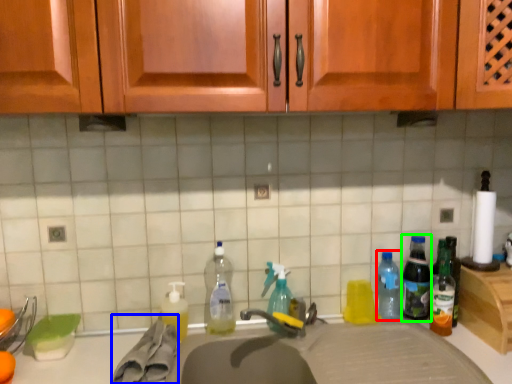
Question: Which object is positioned closest to bottle (highlighted by a red box)? Select from material (highlighted by a blue box) and bottle (highlighted by a green box).

Choices:
 (A) material
 (B) bottle

Answer: (B)